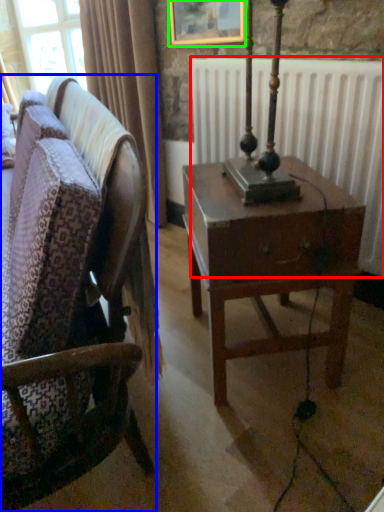
Question: Which object is positioned farthest from radiator (highlighted by a red box)? Select from chair (highlighted by a blue box) and picture frame (highlighted by a green box).

Choices:
 (A) chair
 (B) picture frame

Answer: (A)